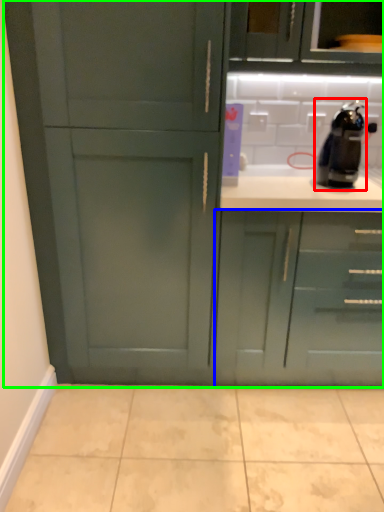
Question: Which object is the farthest from coffee machine (highlighted by a red box)? Choose among these: cabinetry (highlighted by a blue box) or cabinetry (highlighted by a green box).

Choices:
 (A) cabinetry
 (B) cabinetry

Answer: (B)